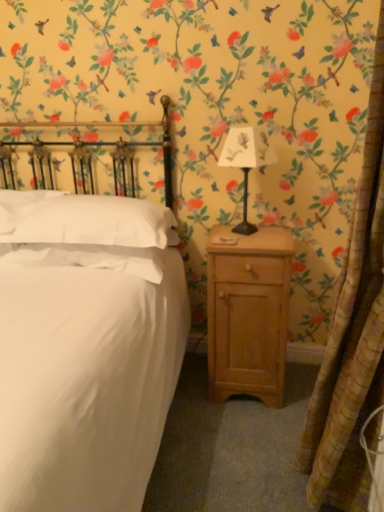
Question: Is white soft pillow at upper left, the second pillow from the right, in front of or behind light wood nightstand at right in the image?

Choices:
 (A) behind
 (B) front

Answer: (A)

Question: Would you say white soft pillow at upper left, the second pillow from the right, is to the left or to the right of light wood nightstand at right in the picture?

Choices:
 (A) left
 (B) right

Answer: (A)

Question: Estimate the real-world distances between objects in this image. Which object is closer to the metallic black lamp at center-right?

Choices:
 (A) light wood nightstand at right
 (B) textured beige curtain at right
 (C) white matte bed at center
 (D) white soft pillow at left, which is the first pillow from right to left
 (E) white soft pillow at upper left, marked as the 1th pillow in a left-to-right arrangement

Answer: (A)

Question: Which is nearer to the textured beige curtain at right?

Choices:
 (A) white soft pillow at left, the 2th pillow when ordered from left to right
 (B) light wood nightstand at right
 (C) white matte bed at center
 (D) white soft pillow at upper left, marked as the 1th pillow in a left-to-right arrangement
 (E) metallic black lamp at center-right

Answer: (B)